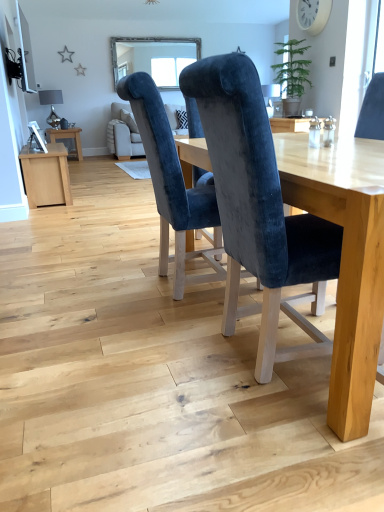
Identify the location of vacant space situated on the left part of velvet blue chair at center, the second chair from the right. (104, 300).